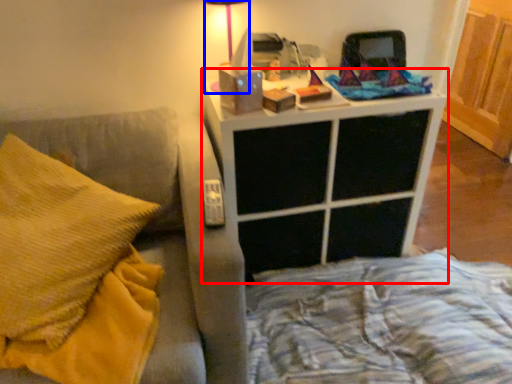
Question: Which object is further to the camera taking this photo, nightstand (highlighted by a red box) or table lamp (highlighted by a blue box)?

Choices:
 (A) nightstand
 (B) table lamp

Answer: (B)